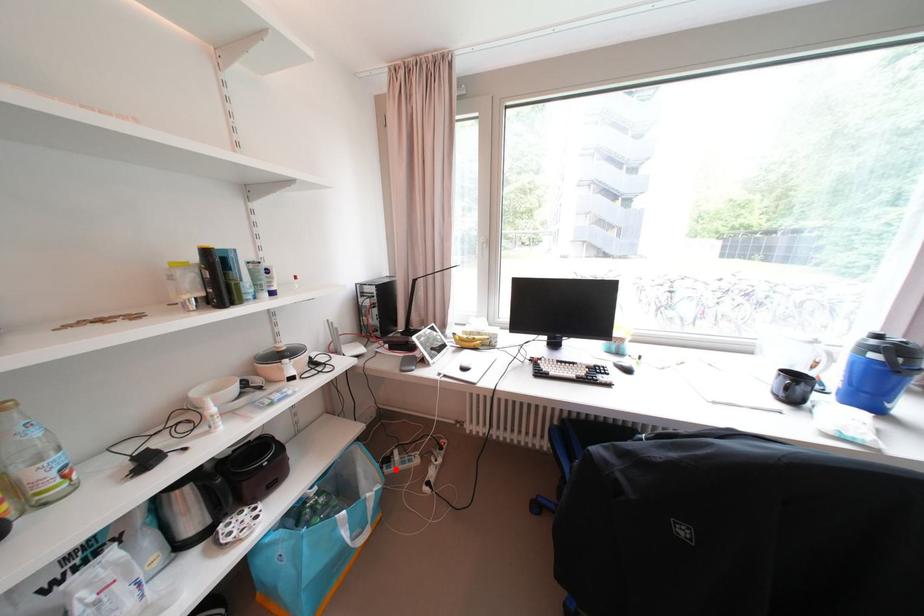
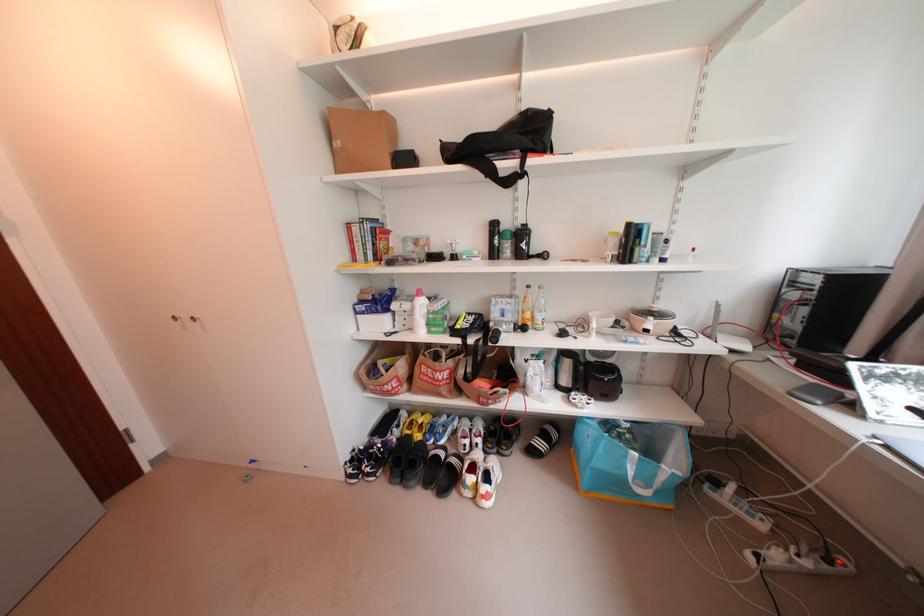
Question: I am providing you with two images of the same scene from different viewpoints. Given a red point in image1, look at the same physical point in image2. Is it:

Choices:
 (A) Closer to the viewpoint
 (B) Farther from the viewpoint

Answer: (B)